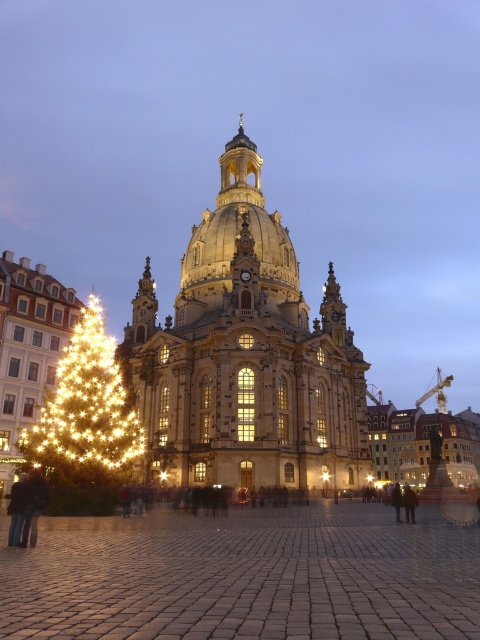
Is point (298, 564) behind point (113, 481)?

No, it is not.

Describe the element at coordinates (244, 577) in the screenshot. I see `brown cobblestone at center` at that location.

This screenshot has height=640, width=480. I want to click on brown cobblestone at center, so click(x=244, y=577).

You are a GUI agent. You are given a task and a screenshot of the screen. Output one action in this format:
    pyautogui.click(x=<x>, y=<y>)
    Task: Click on the brown cobblestone at center
    The height and width of the screenshot is (640, 480).
    Given the screenshot: What is the action you would take?
    click(244, 577)

Who is lower down, brown cobblestone at center or golden stone church at center?

brown cobblestone at center is below.

Between brown cobblestone at center and golden stone church at center, which one appears on the left side from the viewer's perspective?

From the viewer's perspective, golden stone church at center appears more on the left side.

The width and height of the screenshot is (480, 640). What are the coordinates of `brown cobblestone at center` in the screenshot? It's located at (244, 577).

Between golden stone church at center and illuminated gold christmas tree at left, which one appears on the left side from the viewer's perspective?

Positioned to the left is illuminated gold christmas tree at left.

The height and width of the screenshot is (640, 480). What do you see at coordinates (245, 356) in the screenshot?
I see `golden stone church at center` at bounding box center [245, 356].

Measure the distance between point [137,312] and camera.

Point [137,312] is 92.24 meters away from camera.

The width and height of the screenshot is (480, 640). In order to click on golden stone church at center in this screenshot , I will do pyautogui.click(x=245, y=356).